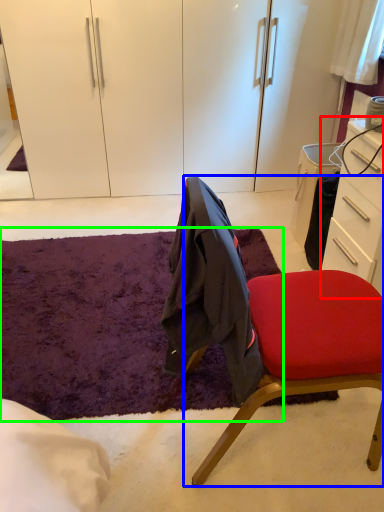
Question: Estimate the real-world distances between objects in this image. Which object is closer to desk (highlighted by a red box), chair (highlighted by a blue box) or mat (highlighted by a green box)?

Choices:
 (A) chair
 (B) mat

Answer: (A)